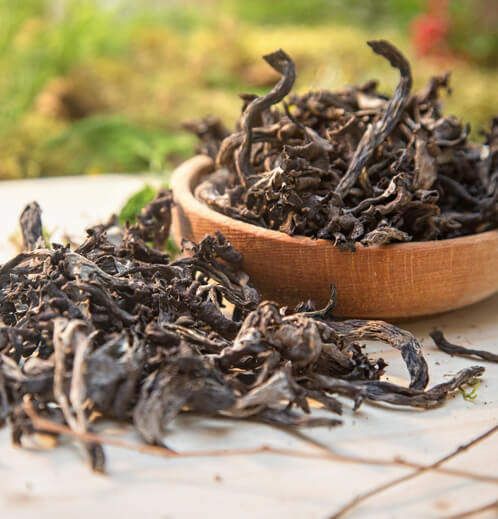
This screenshot has width=498, height=519. I want to click on green plants, so click(53, 49), click(125, 207).